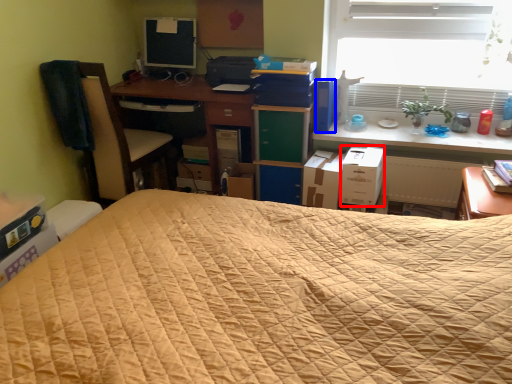
Question: Which of the following is the farthest to the observer, cardboard box (highlighted by a red box) or paperback book (highlighted by a blue box)?

Choices:
 (A) cardboard box
 (B) paperback book

Answer: (B)